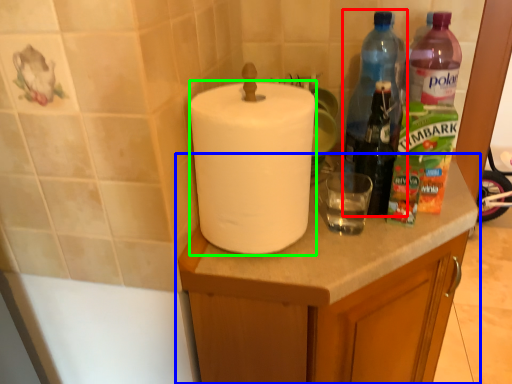
Question: Which object is the farthest from bottle (highlighted by a red box)? Choose among these: cabinetry (highlighted by a blue box) or paper towel (highlighted by a green box).

Choices:
 (A) cabinetry
 (B) paper towel

Answer: (B)